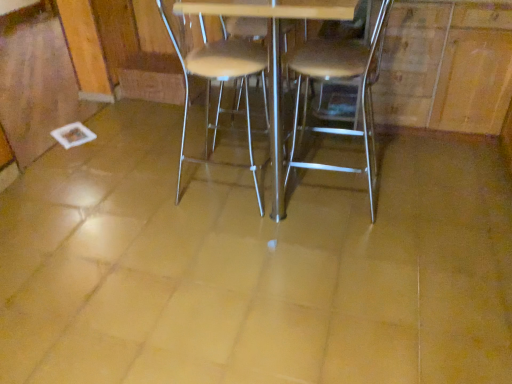
Identify the location of unoccupied space behind metallic silver chair at center, which appears as the 2th chair when viewed from the left. Image resolution: width=512 pixels, height=384 pixels. pos(321,155).